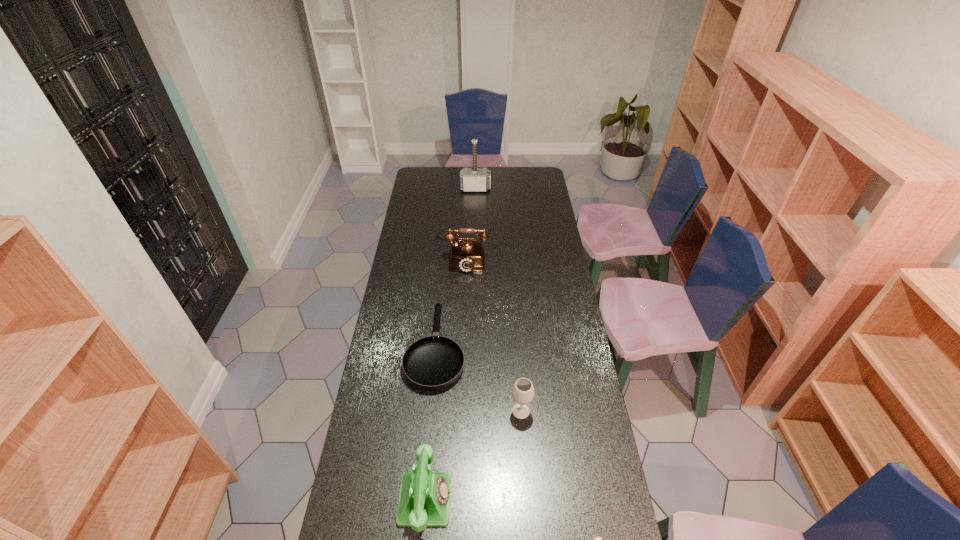
The image size is (960, 540). I want to click on free region located at the end of the handle of the frying pan, so (442, 280).

Find the location of `vacant space located at the end of the handle of the frying pan`. vacant space located at the end of the handle of the frying pan is located at coordinates (440, 302).

Locate an element on the screen. free space located at the end of the handle of the frying pan is located at coordinates point(442,288).

What are the coordinates of `object located in the far edge section of the desktop` in the screenshot? It's located at (474, 179).

Where is `object located in the left edge section of the desktop`? object located in the left edge section of the desktop is located at coordinates (x=434, y=362).

The image size is (960, 540). In the image, there is a desktop. Find the location of `vacant space at the far edge`. vacant space at the far edge is located at coordinates (448, 172).

Find the location of a particular element. This screenshot has height=540, width=960. vacant space at the left edge of the desktop is located at coordinates (376, 379).

The width and height of the screenshot is (960, 540). In order to click on blank area at the right edge in this screenshot , I will do `click(530, 238)`.

In the image, there is a desktop. Identify the location of vacant area at the far left corner. This screenshot has width=960, height=540. (431, 182).

This screenshot has width=960, height=540. Identify the location of blank space at the far right corner. (546, 181).